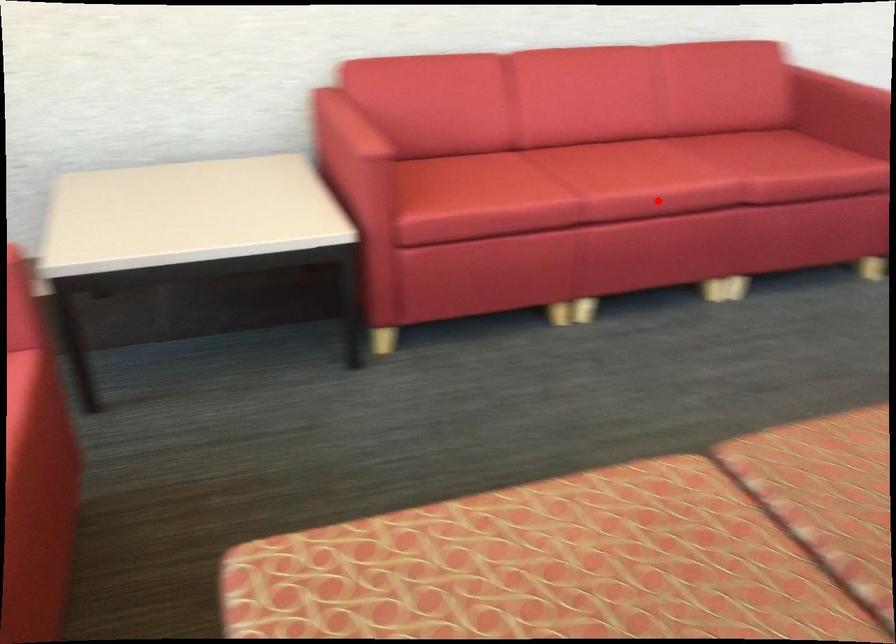
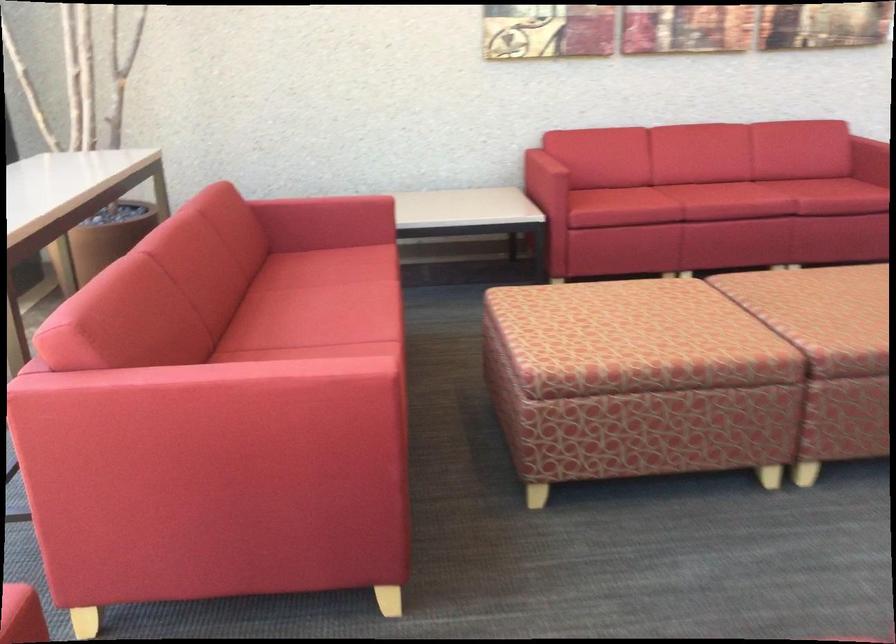
Question: I am providing you with two images of the same scene from different viewpoints. In image1, a red point is highlighted. Considering the same 3D point in image2, which of the following is correct?

Choices:
 (A) It is closer
 (B) It is farther

Answer: (B)